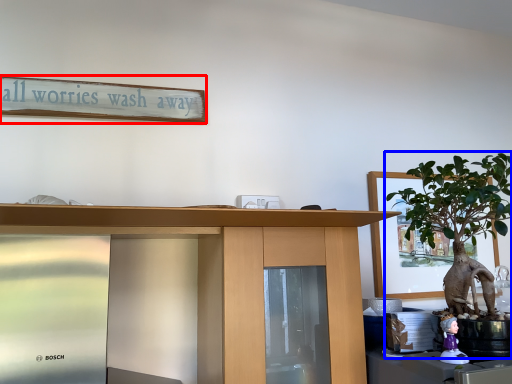
Question: Which object is further to the camera taking this photo, bulletin board (highlighted by a red box) or houseplant (highlighted by a blue box)?

Choices:
 (A) bulletin board
 (B) houseplant

Answer: (A)